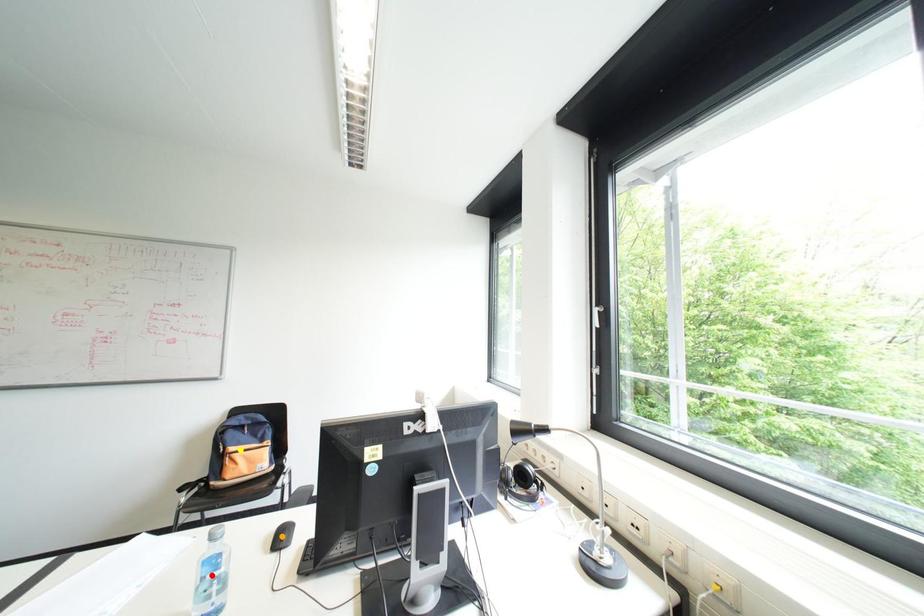
Order these from farthest to nearest:
red point
orange point
yellow point

yellow point < orange point < red point